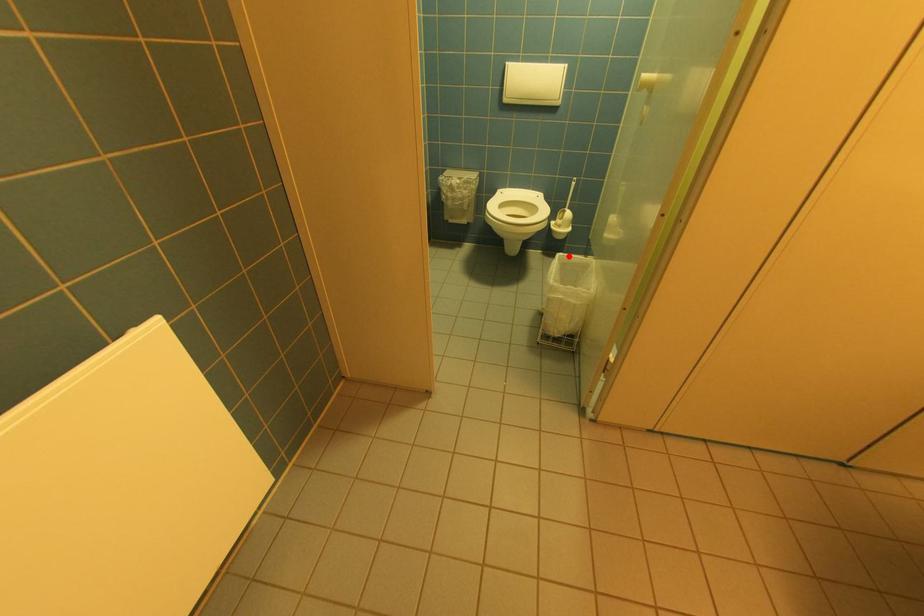
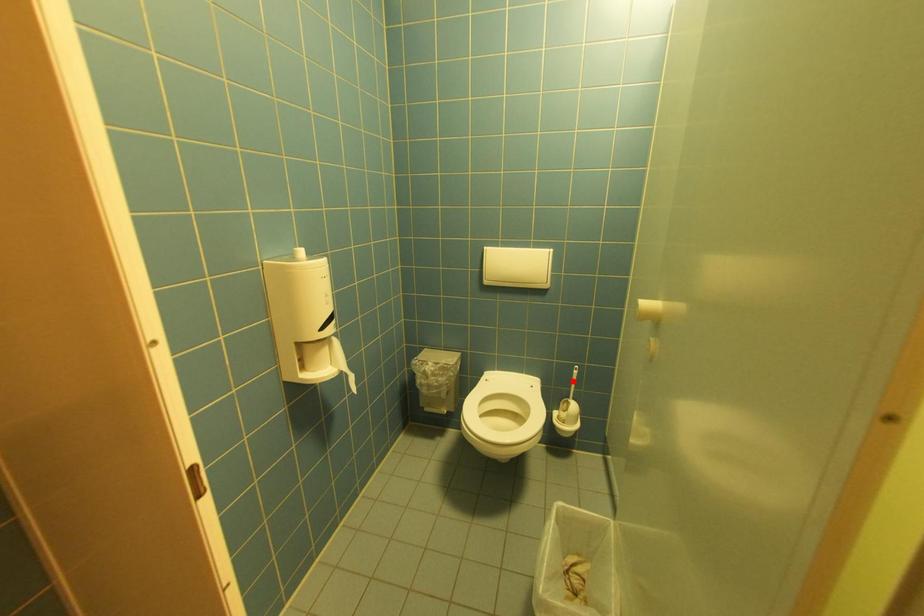
I am providing you with two images of the same scene from different viewpoints. A red point is marked on the first image and another point is marked on the second image. Do the highlighted points in image1 and image2 indicate the same real-world spot?

No